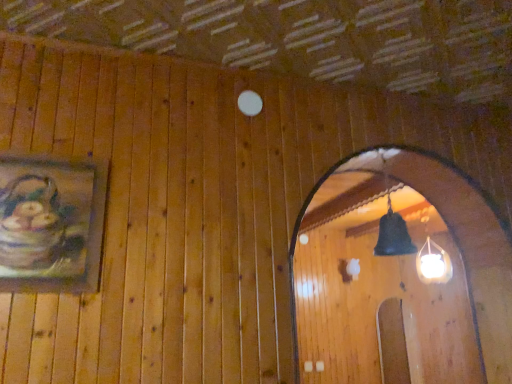
Find the location of a particular element. wooden painted frame at left is located at coordinates (51, 224).

This screenshot has height=384, width=512. What do you see at coordinates (51, 224) in the screenshot?
I see `wooden painted frame at left` at bounding box center [51, 224].

Image resolution: width=512 pixels, height=384 pixels. I want to click on wooden painted frame at left, so click(51, 224).